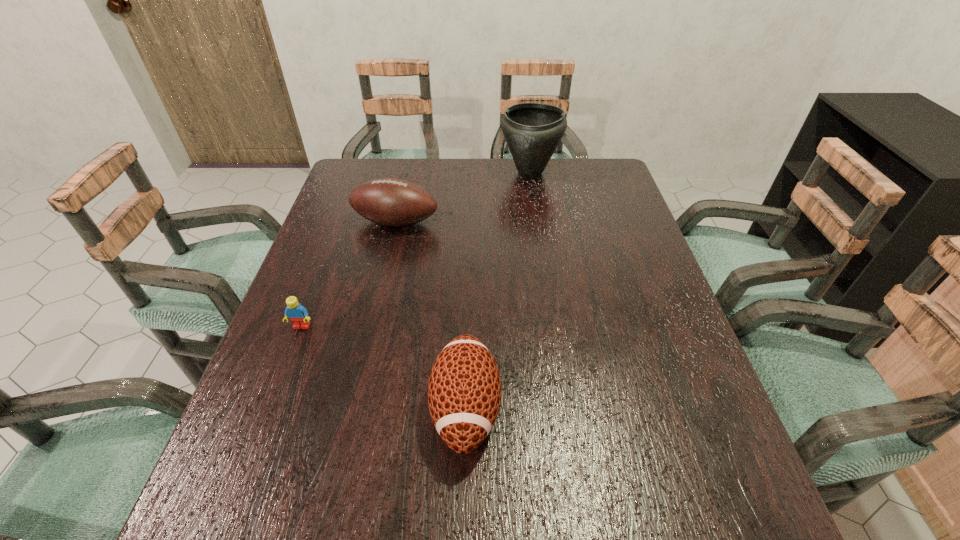
Identify the location of vacant region at the near right corner of the desktop. This screenshot has width=960, height=540. (670, 534).

Where is `free space that is in between the right football and the leftmost object`? Image resolution: width=960 pixels, height=540 pixels. free space that is in between the right football and the leftmost object is located at coordinates [384, 367].

This screenshot has width=960, height=540. I want to click on free spot between the third nearest object and the rightmost object, so click(463, 198).

Where is `free space between the urn and the second object from left to right`? free space between the urn and the second object from left to right is located at coordinates (463, 198).

In order to click on free area in between the third farthest object and the right football in this screenshot , I will do `click(384, 367)`.

The image size is (960, 540). I want to click on vacant area that lies between the right football and the left football, so click(430, 315).

Identify the location of vacant region between the shortest object and the left football. (348, 274).

Locate an element on the screen. The width and height of the screenshot is (960, 540). free space between the nearer football and the left football is located at coordinates (430, 315).

Identify the location of vacant space that's between the Lego and the right football. The width and height of the screenshot is (960, 540). (384, 367).

Find the location of `free area in between the farthest object and the farther football`. free area in between the farthest object and the farther football is located at coordinates (463, 198).